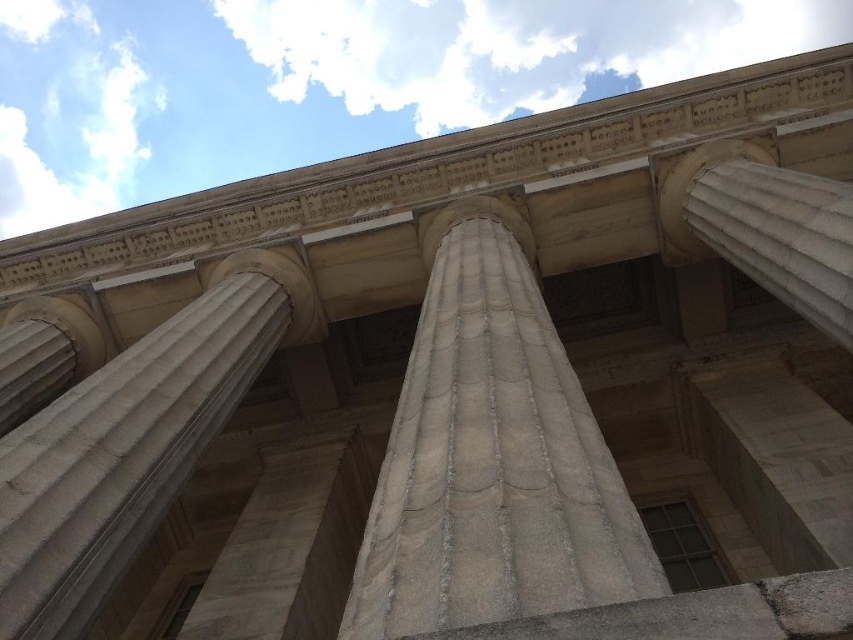
Does point (590, 490) come closer to viewer compared to point (749, 252)?

Yes, point (590, 490) is in front of point (749, 252).

Between white stone column at center and white marble column at upper right, which one appears on the right side from the viewer's perspective?

white marble column at upper right

Find the location of a particular element. This screenshot has width=853, height=640. white stone column at center is located at coordinates (491, 456).

Is white marble column at center below white marble column at upper right?

Yes, white marble column at center is below white marble column at upper right.

Can you confirm if white marble column at center is positioned above white marble column at upper right?

No.

Locate an element on the screen. white marble column at center is located at coordinates pyautogui.click(x=120, y=454).

Where is `white stone column at center`? The height and width of the screenshot is (640, 853). white stone column at center is located at coordinates (491, 456).

Who is positioned more to the right, white stone column at center or white marble column at center?

white stone column at center

Between point (431, 550) and point (262, 310), which one is positioned in front?

Point (431, 550)

Find the location of a particular element. Image resolution: width=853 pixels, height=640 pixels. white stone column at center is located at coordinates (491, 456).